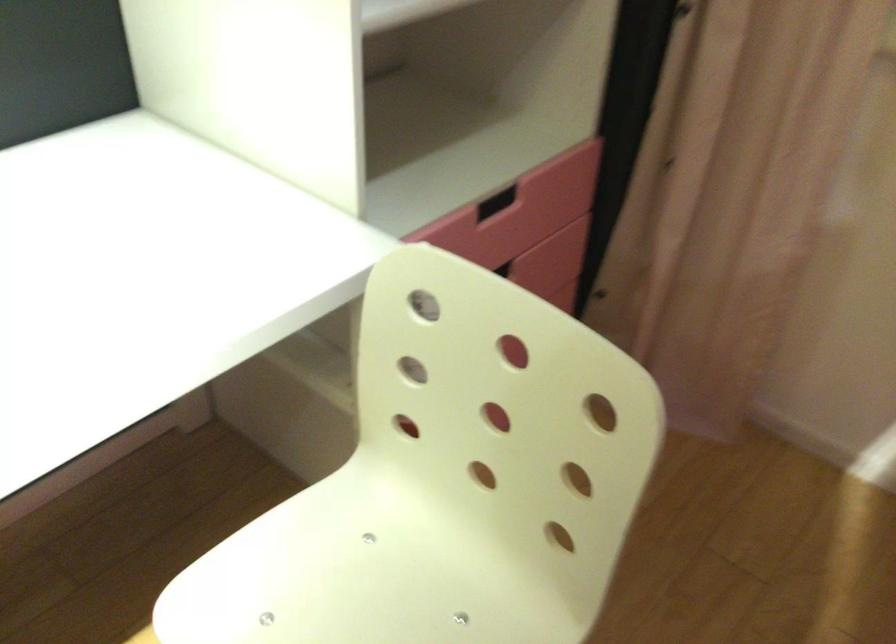
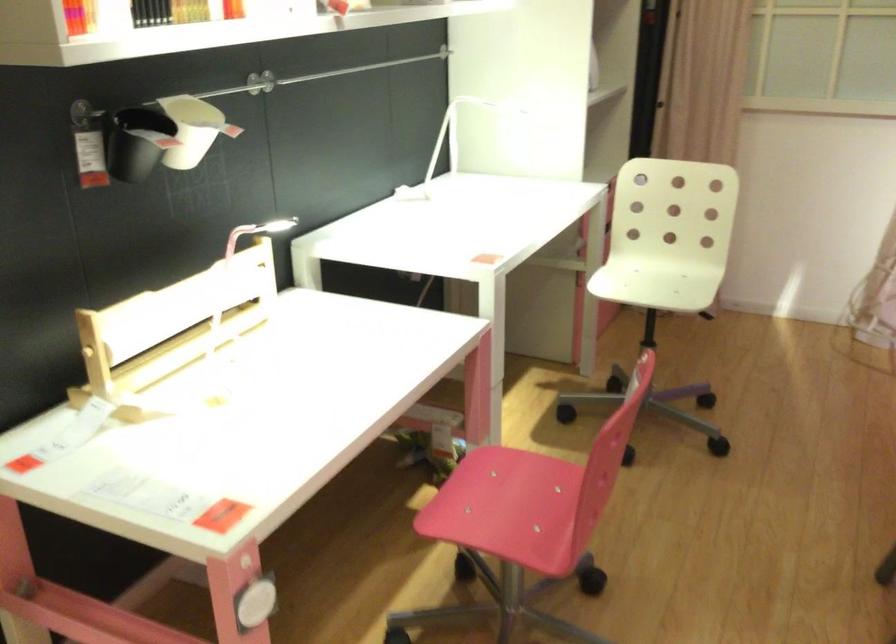
What movement of the cameraman would produce the second image?

The cameraman moved toward left, backward.